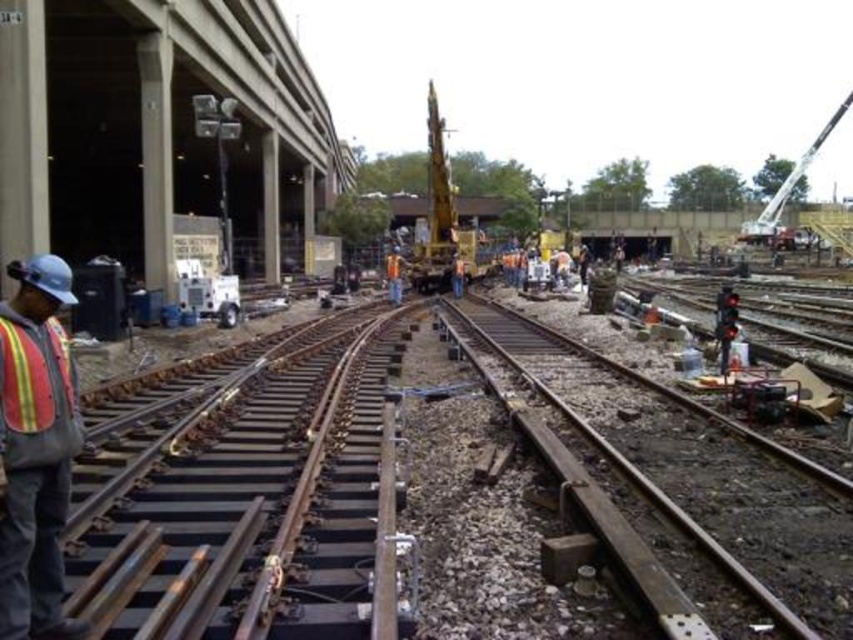
Question: Is reflective safety vest at left closer to camera compared to metallic silver crane at upper right?

Choices:
 (A) no
 (B) yes

Answer: (B)

Question: Which point appears closest to the camera in this image?

Choices:
 (A) (784, 179)
 (B) (38, 282)

Answer: (B)

Question: Does smooth metal rail at center appear on the right side of metallic silver crane at upper right?

Choices:
 (A) yes
 (B) no

Answer: (B)

Question: Considering the real-world distances, which object is closest to the reflective safety vest at left?

Choices:
 (A) metallic silver crane at upper right
 (B) smooth metal rail at center

Answer: (B)

Question: Which is nearer to the reflective safety vest at left?

Choices:
 (A) smooth metal rail at center
 (B) metallic silver crane at upper right

Answer: (A)

Question: Can you confirm if reflective safety vest at left is thinner than metallic silver crane at upper right?

Choices:
 (A) no
 (B) yes

Answer: (B)